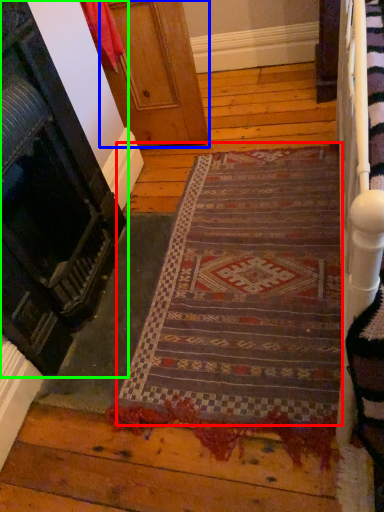
Question: Based on their relative distances, which object is nearer to mat (highlighted by a red box)? Choose from door (highlighted by a blue box) and door (highlighted by a green box).

Choices:
 (A) door
 (B) door

Answer: (B)